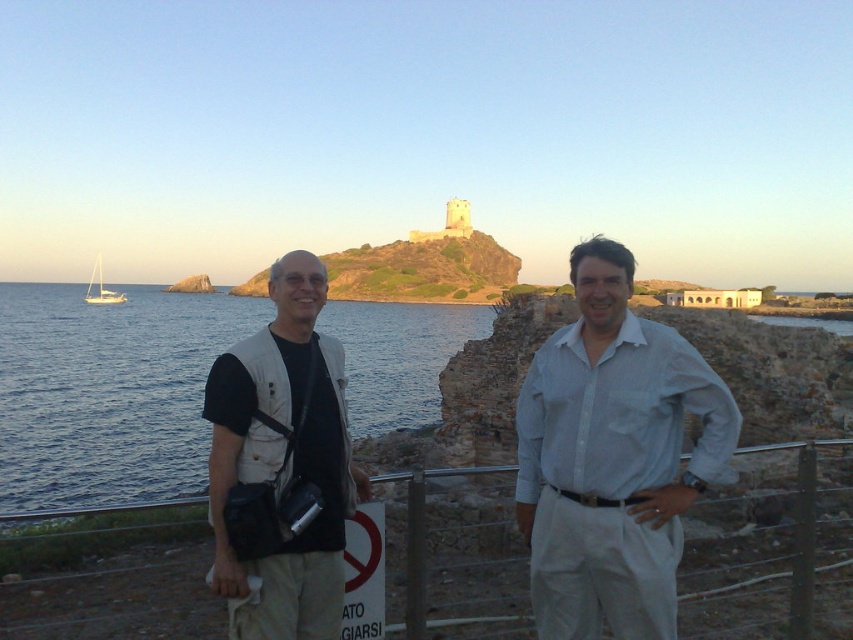
Does light beige vest at center lie in front of beige fabric vest at left?

Yes, it is.

Between point (575, 284) and point (326, 483), which one is positioned behind?

The point (575, 284) is behind.

Where is `light beige vest at center`? light beige vest at center is located at coordinates (619, 440).

Identify the location of light beige vest at center. point(619,440).

Between blue water at left and white cotton shirt at center, which one appears on the left side from the viewer's perspective?

From the viewer's perspective, blue water at left appears more on the left side.

Consider the image. Is blue water at left thinner than white cotton shirt at center?

No.

At what (x,y) coordinates should I click in order to perform the action: click on blue water at left. Please return your answer as a coordinate pair (x, y). Image resolution: width=853 pixels, height=640 pixels. Looking at the image, I should click on (108, 392).

Who is more forward, (109, 529) or (97, 280)?

Point (109, 529)

How far apart are metal/rustic rail at center and white glossy sailboat at left?

206.72 meters

Does point (480, 468) come closer to viewer compared to point (91, 289)?

Yes, it is.

This screenshot has height=640, width=853. Find the location of `metal/rustic rail at center`. metal/rustic rail at center is located at coordinates (424, 547).